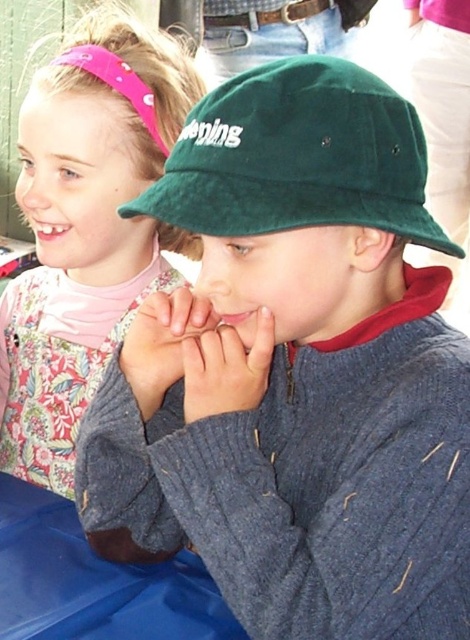
Question: Which of the following is the closest to the observer?

Choices:
 (A) (274, 342)
 (B) (335, 198)
 (C) (54, 113)

Answer: (B)

Question: Is green velvety hat at center to the right of smooth skin hand at center from the viewer's perspective?

Choices:
 (A) no
 (B) yes

Answer: (B)

Question: Among these objects, which one is farthest from the camera?

Choices:
 (A) pink fabric headband at upper left
 (B) matte pink fabric at upper left

Answer: (A)

Question: Does green velvety hat at center come in front of smooth skin hand at center?

Choices:
 (A) yes
 (B) no

Answer: (A)

Question: Can you confirm if smooth skin hand at center is bigger than matte pink fabric at upper left?

Choices:
 (A) yes
 (B) no

Answer: (B)

Question: Considering the real-world distances, which object is closest to the smooth skin hand at center?

Choices:
 (A) pink fabric headband at upper left
 (B) matte pink fabric at upper left
 (C) green velvety hat at center

Answer: (B)